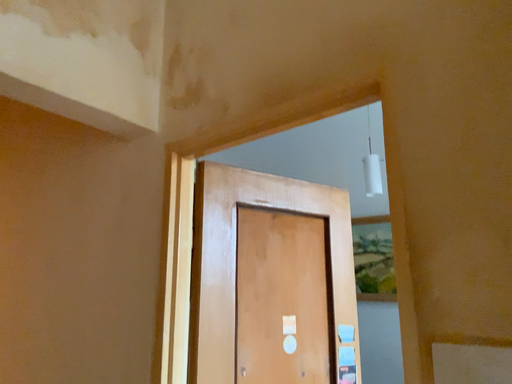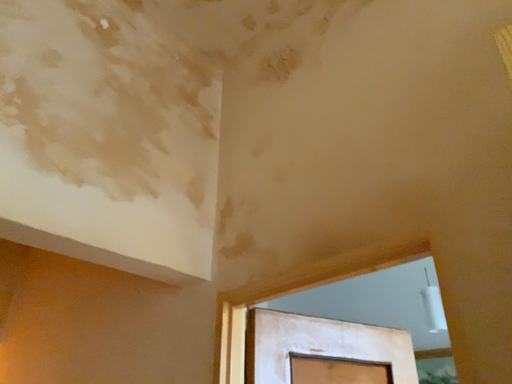
Question: Which way did the camera rotate in the video?

Choices:
 (A) rotated downward
 (B) rotated upward

Answer: (B)